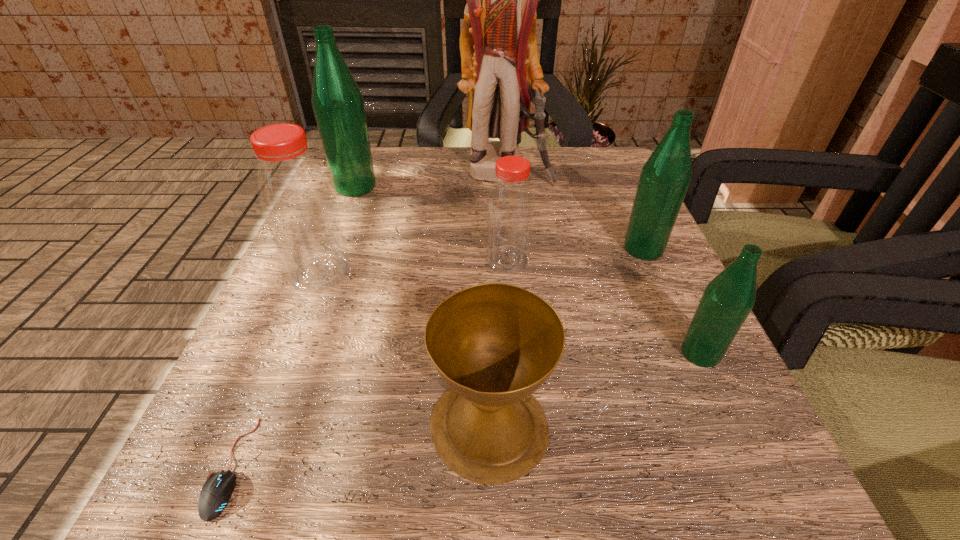
Identify the location of brown chalice. The width and height of the screenshot is (960, 540). [494, 344].

Where is `black mouse`? black mouse is located at coordinates (216, 492).

What are the coordinates of `mouse` in the screenshot? It's located at (216, 492).

Identify the location of vacant space located 0.380m on the front-facing side of the tallest object. (519, 326).

This screenshot has height=540, width=960. In order to click on free spot located 0.260m on the right of the farthest bottle in this screenshot , I will do `click(503, 187)`.

At what (x,y) coordinates should I click in order to perform the action: click on free location located on the back of the bigger red bottle. Please return your answer as a coordinate pair (x, y). This screenshot has width=960, height=540. Looking at the image, I should click on (371, 151).

Where is `vacant space located 0.070m on the front of the second smallest green bottle`? This screenshot has height=540, width=960. vacant space located 0.070m on the front of the second smallest green bottle is located at coordinates (662, 292).

I want to click on free spot located on the front of the right red bottle, so click(x=520, y=436).

Locate an element on the screen. free region located on the left of the smallest green bottle is located at coordinates (436, 353).

Identify the location of vacant region located on the back of the brown chalice. Image resolution: width=960 pixels, height=540 pixels. (486, 234).